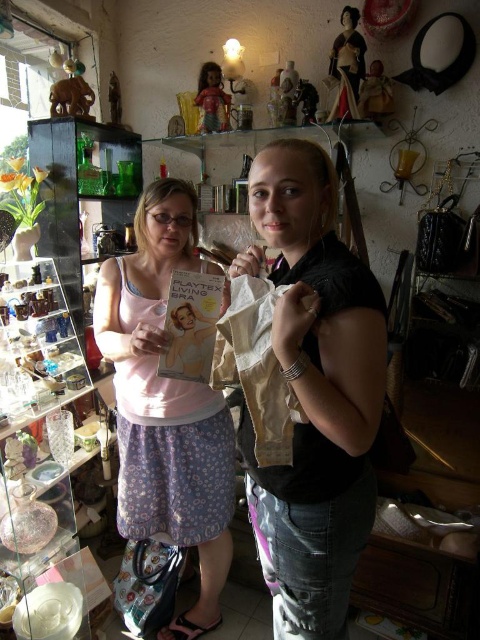
You are a customer in the antique shop and want to know which item is wider between the pink fabric bra at left and the matte brown figurine at upper left. Can you determine this?

The pink fabric bra at left is wider than the matte brown figurine at upper left according to the description.

You are standing in the antique shop and want to determine which of the two points, point (305, 493) or point (193, 461), is nearer to you. Based on the scene, which point is closer?

Point (305, 493) is closer to the viewer than point (193, 461).